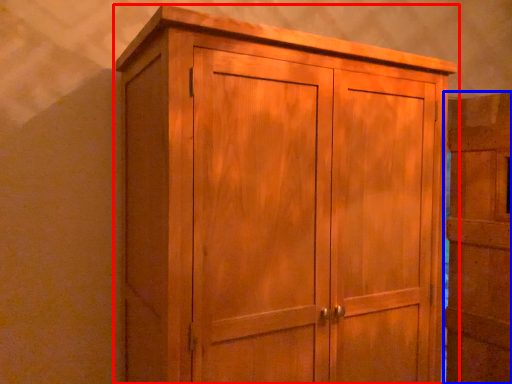
Question: Which object is closer to the camera taking this photo, cupboard (highlighted by a red box) or door (highlighted by a blue box)?

Choices:
 (A) cupboard
 (B) door

Answer: (A)